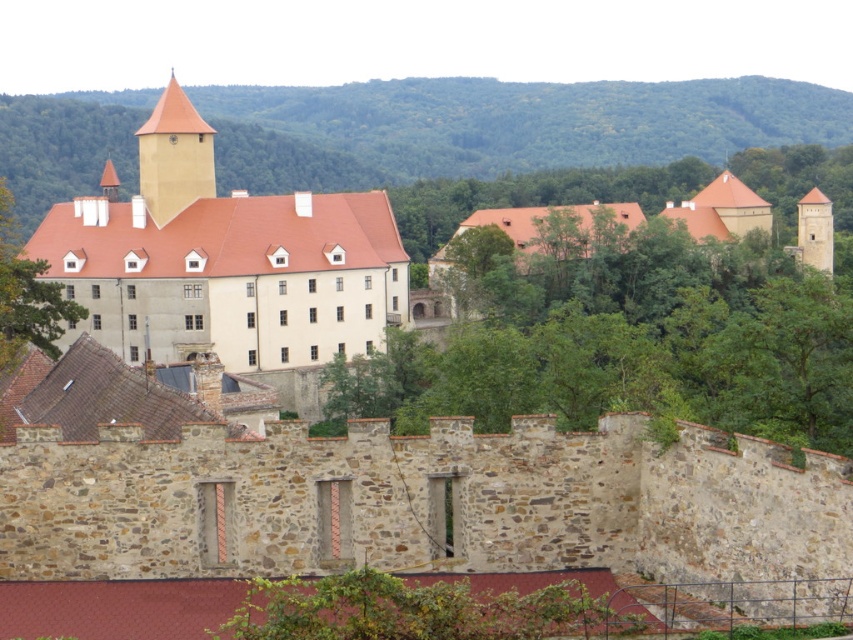
You are standing in the castle courtyard and see a point marked at coordinates point (222, 259). What is the location of this point relative to the castle buildings?

The point (222, 259) is located on the matte beige stone building at center, which is part of the castle complex.

You are an architect analyzing the layout of the castle grounds. You notice a specific point marked at coordinates point (500, 128). What natural feature is located at this point?

The green leafy hillside at upper center is located at point (500, 128).